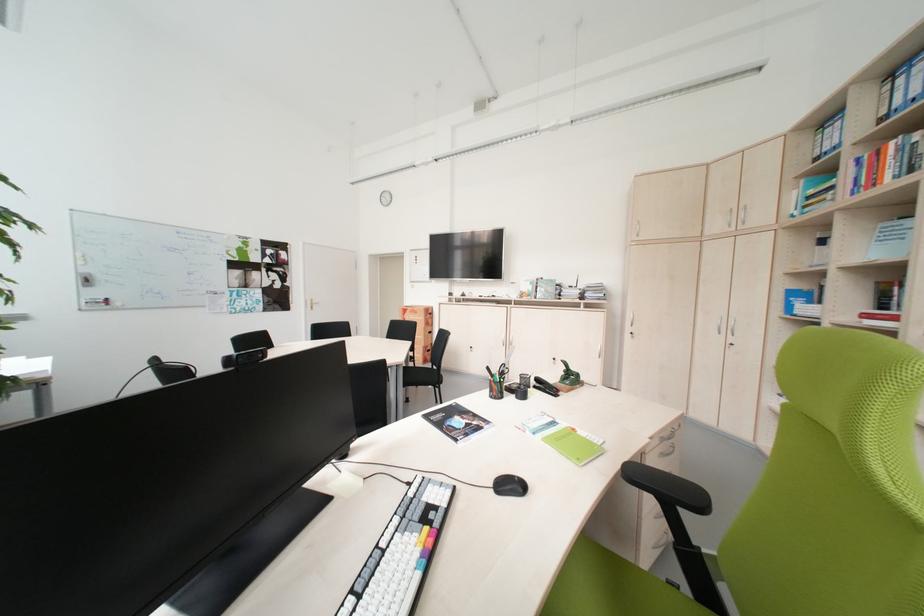
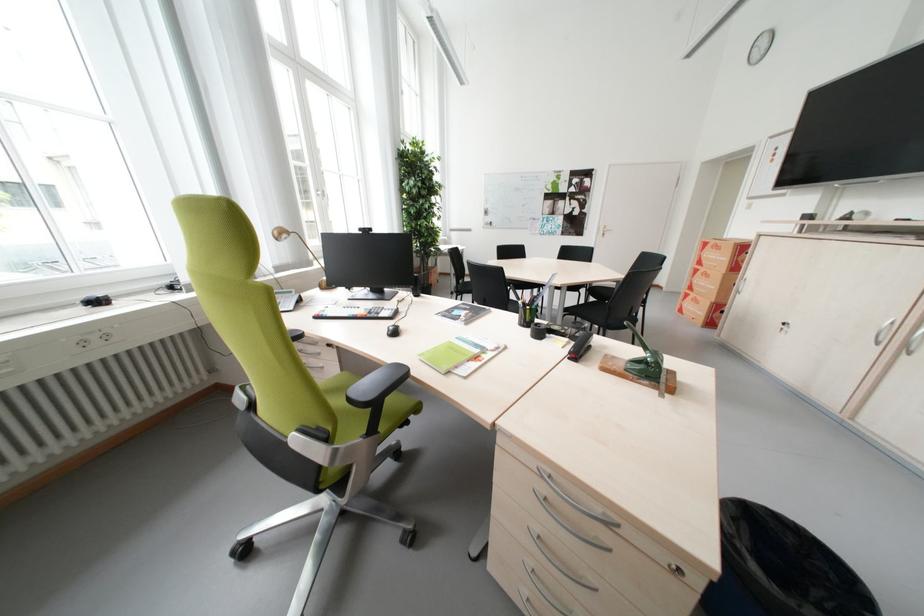
Where in the second image is the point corresponding to [415,312] from the first image?

(715, 246)